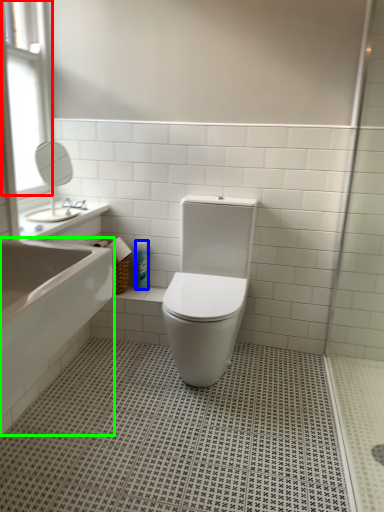
Question: Considering the real-world distances, which object is closest to window (highlighted by a red box)? toiletry (highlighted by a blue box) or bath (highlighted by a green box).

Choices:
 (A) toiletry
 (B) bath

Answer: (A)